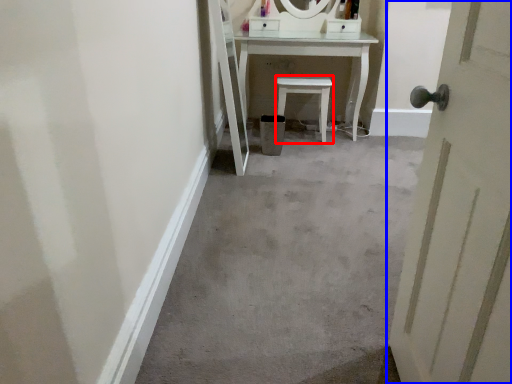
Question: Which of the following is the farthest to the observer, furniture (highlighted by a red box) or door (highlighted by a blue box)?

Choices:
 (A) furniture
 (B) door

Answer: (A)